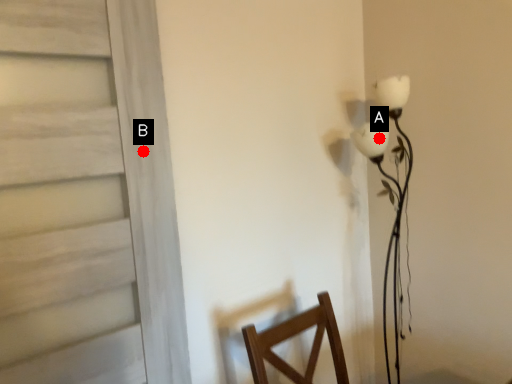
Question: Two points are circled on the image, labeled by A and B beside each circle. Which point is further to the camera?

Choices:
 (A) A is further
 (B) B is further

Answer: (A)